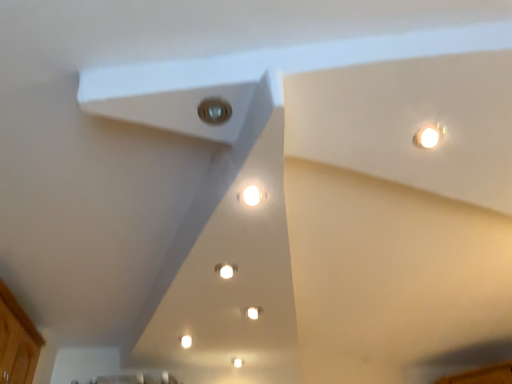
Question: Does white glossy light at center, placed as the 1th light when sorted from back to front, have a larger size compared to wooden cabinet at lower left?

Choices:
 (A) no
 (B) yes

Answer: (A)

Question: Does white glossy light at center, placed as the 1th light when sorted from back to front, contain wooden cabinet at lower left?

Choices:
 (A) no
 (B) yes

Answer: (A)

Question: Is white glossy light at center, marked as the second light in a front-to-back arrangement, taller than wooden cabinet at lower left?

Choices:
 (A) no
 (B) yes

Answer: (A)

Question: Are white glossy light at center, the second light viewed from the top, and wooden cabinet at lower left located far from each other?

Choices:
 (A) no
 (B) yes

Answer: (A)

Question: Is white glossy light at center, marked as the second light in a front-to-back arrangement, shorter than wooden cabinet at lower left?

Choices:
 (A) no
 (B) yes

Answer: (B)

Question: Is white glossy light at center, which appears as the first light when ordered from the bottom, with wooden cabinet at lower left?

Choices:
 (A) no
 (B) yes

Answer: (A)

Question: From the image's perspective, is matte glass light at center, which is the 2th light from bottom to top, above wooden cabinet at lower left?

Choices:
 (A) yes
 (B) no

Answer: (A)

Question: From the image's perspective, is matte glass light at center, which is the 2th light in back-to-front order, beneath wooden cabinet at lower left?

Choices:
 (A) yes
 (B) no

Answer: (B)

Question: Does matte glass light at center, which is the 2th light in back-to-front order, contain wooden cabinet at lower left?

Choices:
 (A) yes
 (B) no

Answer: (B)

Question: Considering the relative sizes of matte glass light at center, which is the 2th light in back-to-front order, and wooden cabinet at lower left in the image provided, is matte glass light at center, which is the 2th light in back-to-front order, smaller than wooden cabinet at lower left?

Choices:
 (A) no
 (B) yes

Answer: (B)

Question: Considering the relative positions of matte glass light at center, which is the 2th light in back-to-front order, and wooden cabinet at lower left in the image provided, is matte glass light at center, which is the 2th light in back-to-front order, behind wooden cabinet at lower left?

Choices:
 (A) no
 (B) yes

Answer: (A)

Question: Considering the relative positions of matte glass light at center, which is the 2th light in back-to-front order, and wooden cabinet at lower left in the image provided, is matte glass light at center, which is the 2th light in back-to-front order, to the left of wooden cabinet at lower left from the viewer's perspective?

Choices:
 (A) yes
 (B) no

Answer: (B)

Question: Is wooden cabinet at lower left turned away from matte glass light at center, which is the 2th light in back-to-front order?

Choices:
 (A) yes
 (B) no

Answer: (B)